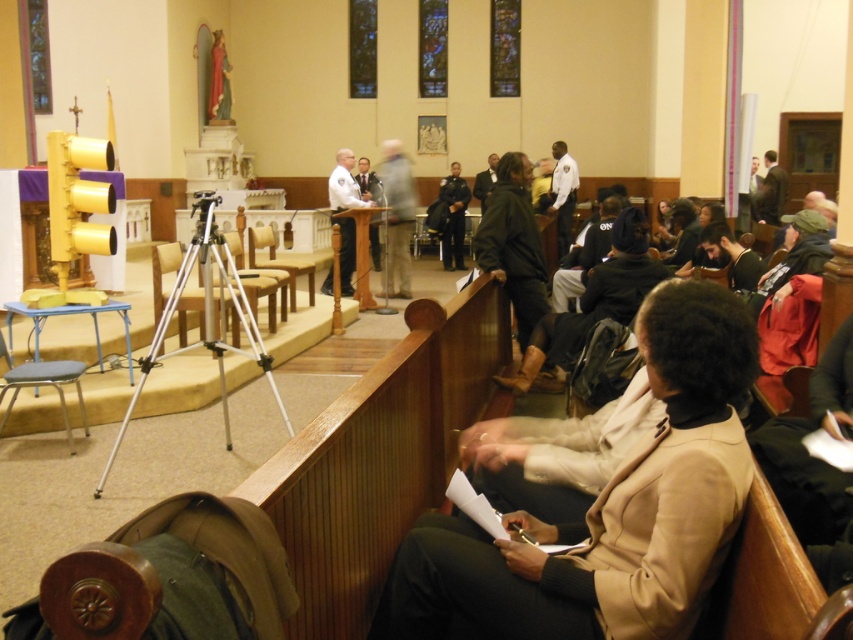
Looking at this image, you are organizing a photo shoot and need to place a camera stand that requires a space larger than the dark uniformed officer at center. Can the metallic tripod at center accommodate this requirement?

The metallic tripod at center is bigger than the dark uniformed officer at center, so it can accommodate the camera stand that requires a space larger than the dark uniformed officer at center.

You are organizing a photo shoot and need to arrange the beige wool coat at center and the matte black suit at center in a way that highlights both. Considering their sizes, which object should you place in a position where it won

The beige wool coat at center occupies less space than the matte black suit at center, so you should place the beige wool coat at center in a position where it won